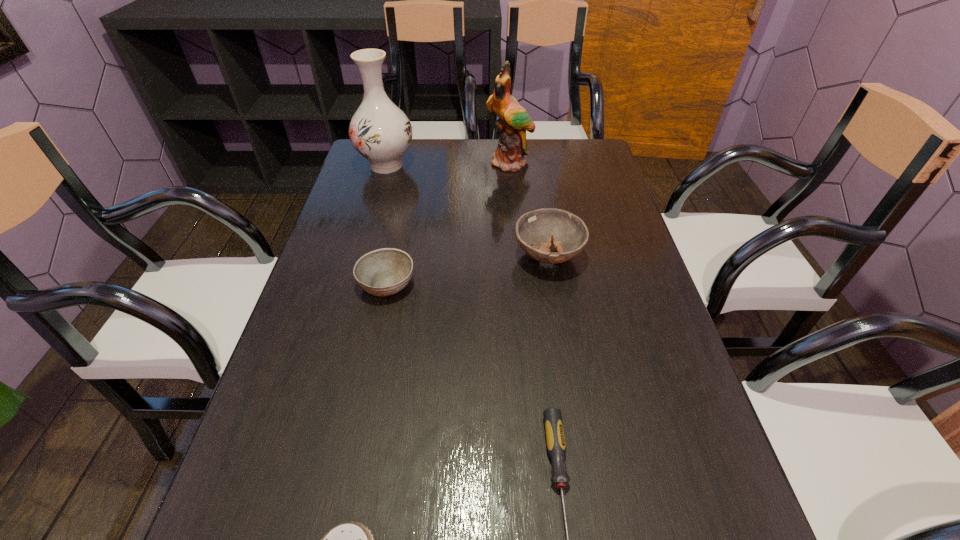
You are a GUI agent. You are given a task and a screenshot of the screen. Output one action in this format:
    pyautogui.click(x=<x>, y=<y>)
    Task: Click on the vase
    The width and height of the screenshot is (960, 540).
    Given the screenshot: What is the action you would take?
    pyautogui.click(x=380, y=131)

This screenshot has width=960, height=540. Find the location of `parrot`. parrot is located at coordinates (514, 121).

You are a GUI agent. You are given a task and a screenshot of the screen. Output one action in this format:
    pyautogui.click(x=<x>, y=<y>)
    Task: Click on the fourth shortest object
    Image resolution: width=960 pixels, height=540 pixels.
    Given the screenshot: What is the action you would take?
    pyautogui.click(x=535, y=230)

Identify the location of the right bowl. (535, 230).

Where is `the shorter bowl`? Image resolution: width=960 pixels, height=540 pixels. the shorter bowl is located at coordinates (383, 272).

Identify the location of the third shortest object. (383, 272).

I want to click on blank area located on the front of the vase, so click(376, 200).

Locate an element on the screen. This screenshot has width=960, height=540. vacant region located 0.370m on the front-facing side of the parrot is located at coordinates (517, 252).

Find the location of `vacant space situated 0.340m on the left of the taller bowl`. vacant space situated 0.340m on the left of the taller bowl is located at coordinates (380, 256).

Identify the location of free location located on the right of the fourth tallest object. (453, 283).